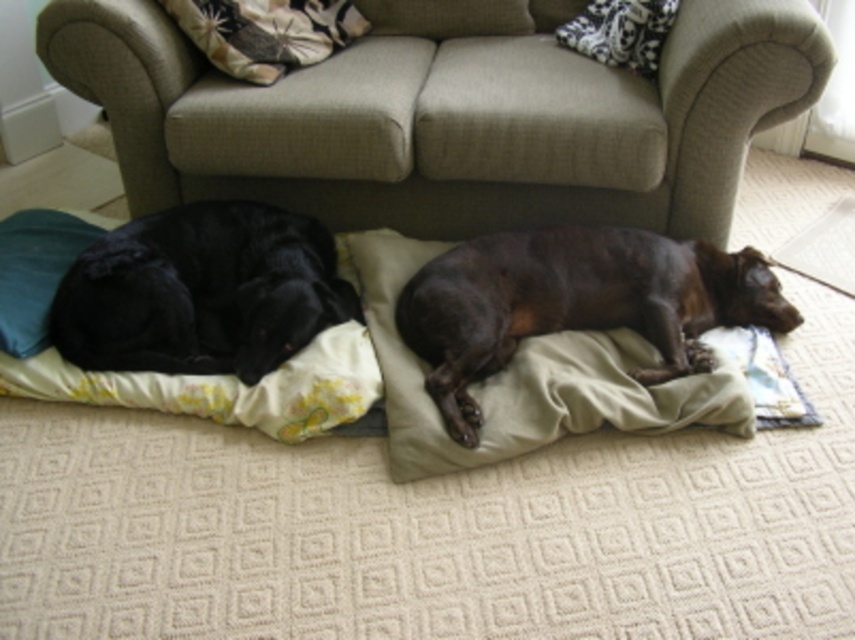
Who is positioned more to the left, brown fuzzy dog at lower right or shiny black dog at left?

Positioned to the left is shiny black dog at left.

Is brown fuzzy dog at lower right wider than shiny black dog at left?

Indeed, brown fuzzy dog at lower right has a greater width compared to shiny black dog at left.

Which is in front, point (478, 339) or point (104, 280)?

Point (478, 339) is more forward.

Image resolution: width=855 pixels, height=640 pixels. Find the location of `brown fuzzy dog at lower right`. brown fuzzy dog at lower right is located at coordinates (576, 304).

Consider the image. Does brown fuzzy dog at lower right have a larger size compared to fluffy fabric pillow at upper center?

Indeed, brown fuzzy dog at lower right has a larger size compared to fluffy fabric pillow at upper center.

Can you confirm if brown fuzzy dog at lower right is taller than fluffy fabric pillow at upper center?

Indeed, brown fuzzy dog at lower right has a greater height compared to fluffy fabric pillow at upper center.

Is point (504, 257) more distant than point (233, 20)?

No, it is in front of (233, 20).

Identify the location of brown fuzzy dog at lower right. (576, 304).

Can you confirm if beige fabric couch at upper center is wider than shiny black dog at left?

Yes, beige fabric couch at upper center is wider than shiny black dog at left.

Is point (122, 20) more distant than point (234, 310)?

No, (122, 20) is in front of (234, 310).

Is point (345, 179) positioned behind point (144, 333)?

Yes, point (345, 179) is behind point (144, 333).

Locate an element on the screen. The image size is (855, 640). beige fabric couch at upper center is located at coordinates (449, 115).